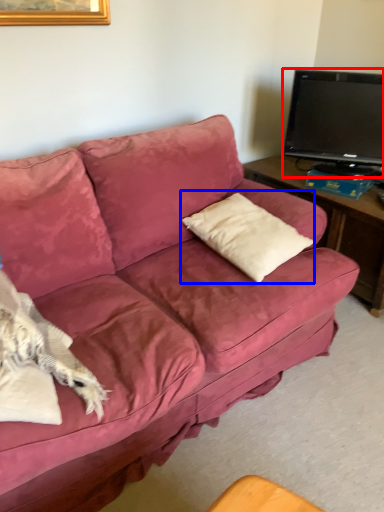
Question: Among these objects, which one is nearest to the camera, television (highlighted by a red box) or throw pillow (highlighted by a blue box)?

Choices:
 (A) television
 (B) throw pillow

Answer: (B)